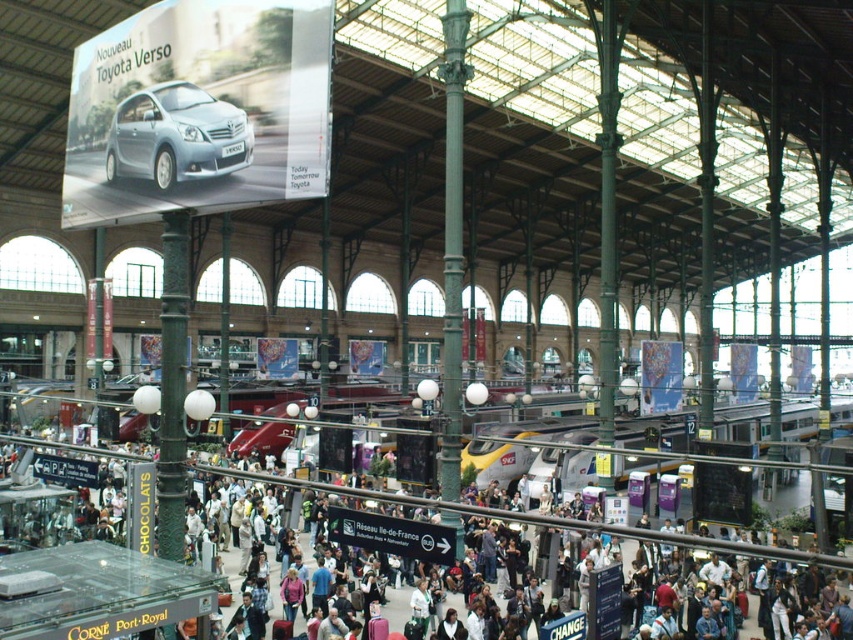
Question: Can you confirm if silver metallic car at upper left is wider than matte black crowd at center?

Choices:
 (A) yes
 (B) no

Answer: (B)

Question: Is silver metallic car at upper left further to the viewer compared to matte black crowd at center?

Choices:
 (A) yes
 (B) no

Answer: (A)

Question: Which point is closer to the camera?

Choices:
 (A) matte black crowd at center
 (B) silver metallic car at upper left

Answer: (A)

Question: Is silver metallic car at upper left to the left of matte black crowd at center from the viewer's perspective?

Choices:
 (A) yes
 (B) no

Answer: (A)